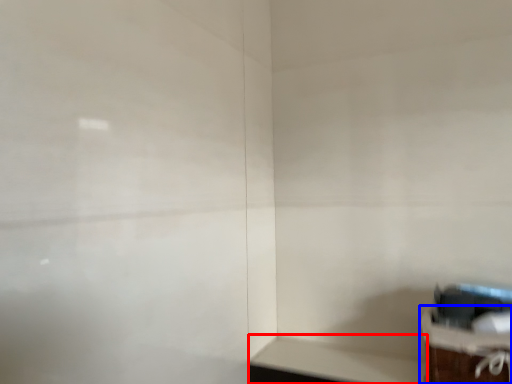
Question: Among these objects, which one is nearest to the camera, table (highlighted by a red box) or furniture (highlighted by a blue box)?

Choices:
 (A) table
 (B) furniture

Answer: (B)